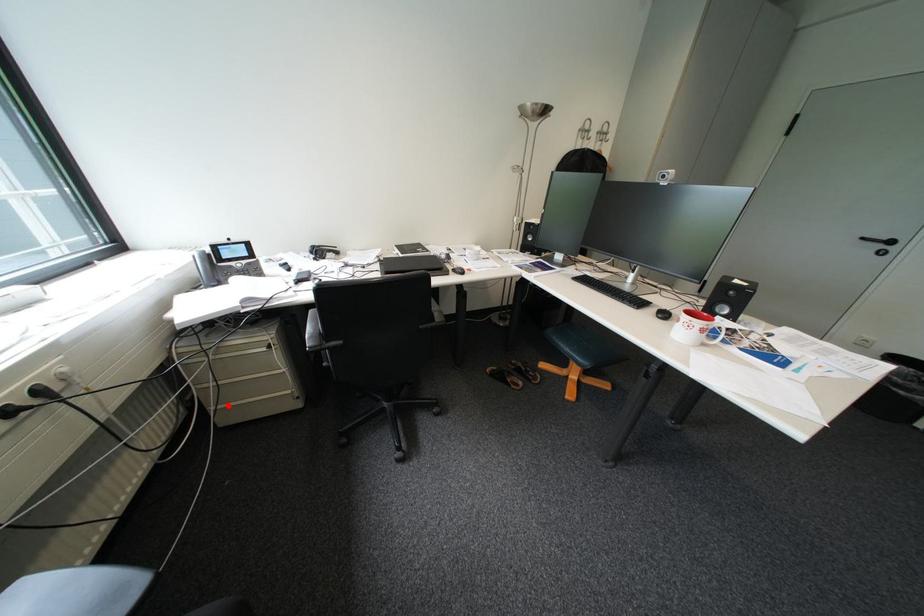
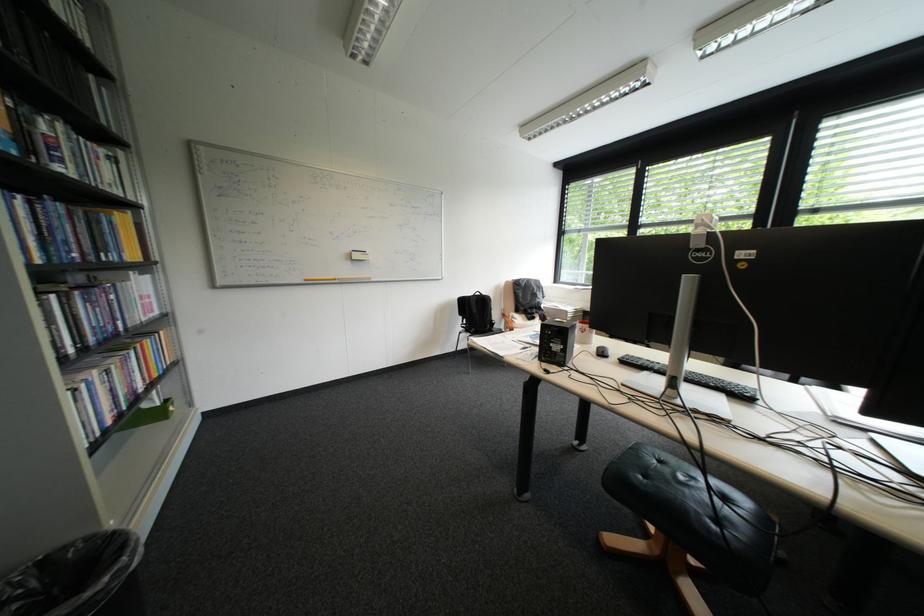
Question: I am providing you with two images of the same scene from different viewpoints. A red point is marked on the first image. Can you still see the location of the red point in image 2?

Choices:
 (A) Yes
 (B) No

Answer: (B)